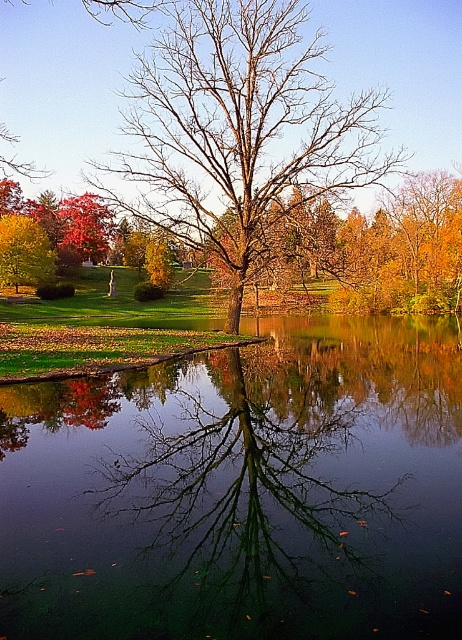
Is bare wood tree at center smaller than yellow-green leaves at left?

Actually, bare wood tree at center might be larger than yellow-green leaves at left.

From the picture: Is bare wood tree at center to the left of yellow-green leaves at left from the viewer's perspective?

No, bare wood tree at center is not to the left of yellow-green leaves at left.

Is point (228, 269) less distant than point (48, 252)?

Yes, it is in front of point (48, 252).

The image size is (462, 640). I want to click on bare wood tree at center, so click(x=238, y=131).

Can you confirm if green reflective water at center is shorter than yellow-green leaves at left?

Correct, green reflective water at center is not as tall as yellow-green leaves at left.

Is green reflective water at center below yellow-green leaves at left?

Correct, green reflective water at center is located below yellow-green leaves at left.

Describe the element at coordinates (242, 492) in the screenshot. The height and width of the screenshot is (640, 462). I see `green reflective water at center` at that location.

At what (x,y) coordinates should I click in order to perform the action: click on green reflective water at center. Please return your answer as a coordinate pair (x, y). Looking at the image, I should click on (242, 492).

Which is more to the right, green reflective water at center or bare wood tree at center?

From the viewer's perspective, green reflective water at center appears more on the right side.

Who is lower down, green reflective water at center or bare wood tree at center?

Positioned lower is green reflective water at center.

The image size is (462, 640). What are the coordinates of `green reflective water at center` in the screenshot? It's located at (242, 492).

Locate an element on the screen. The image size is (462, 640). green reflective water at center is located at coordinates (242, 492).